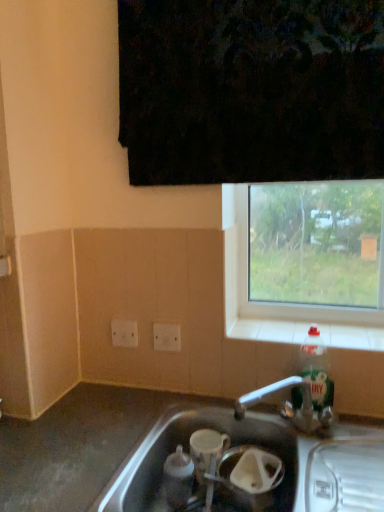
The height and width of the screenshot is (512, 384). Find the location of `vacant space situated above white tile at lower right (from a real-world perspective)`. vacant space situated above white tile at lower right (from a real-world perspective) is located at coordinates (303, 331).